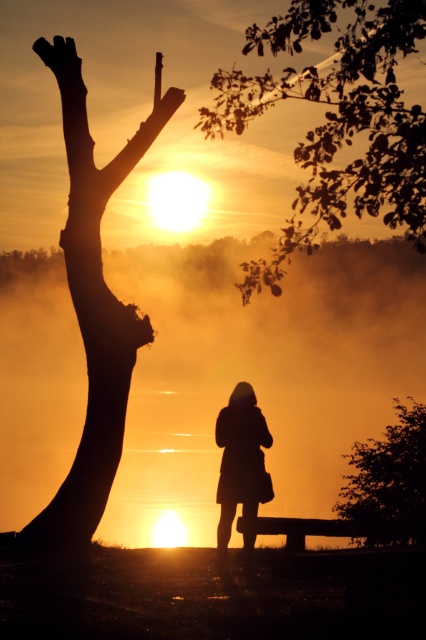
You are standing at point (94, 332) in the image. Looking towards the silhouette wood at left, which direction should you face?

You should face to the right because the silhouette wood at left is located to your right side when standing at point (94, 332).

You are an artist sketching the sunset scene. You notice the silhouette wood at left and the silhouette leafy tree at upper right. Which object in your drawing should you make taller to maintain accuracy?

The silhouette wood at left should be made taller than the silhouette leafy tree at upper right to maintain accuracy.

You are a painter standing at the wooden park bench at lower center. You want to paint the smooth bark tree at upper right. Since the tree is partially hidden by something, can you still see the entire tree?

The smooth bark tree at upper right is in front of the wooden park bench at lower center, so it is blocking part of the tree from your view. Therefore, you cannot see the entire tree.